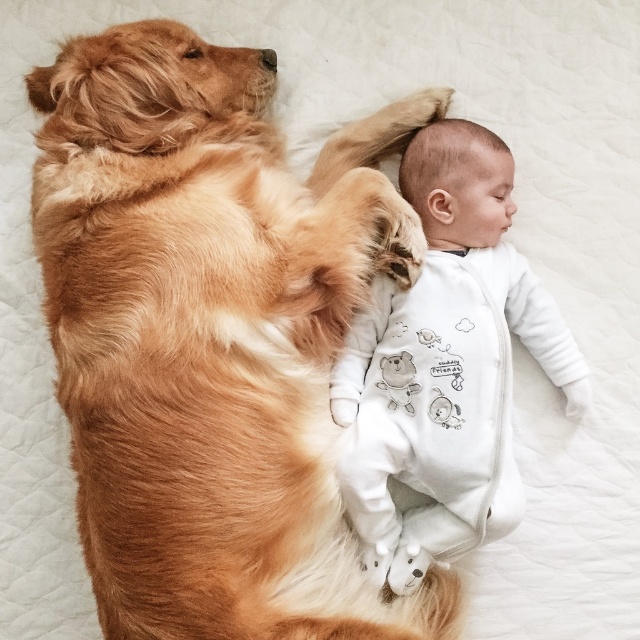
You are a parent holding a small toy that is 15 centimeters long. You want to place the toy between the golden fur dog at upper left and the white soft onesie at center so that both the dog and the baby can reach it easily. Is this possible?

The golden fur dog at upper left and the white soft onesie at center are 13.63 centimeters apart. Since the toy is 15 centimeters long, it cannot fit between them as the distance is shorter than the toy.

You are a photographer taking a picture of the golden fur dog at upper left. Where should you position your camera to capture the dog in the frame?

The golden fur dog at upper left is located at point (211, 336), so you should position your camera at that coordinate to capture the dog in the frame.

You are a parent who wants to ensure the baby in the white soft onesie at center is safe from the golden fur dog at upper left. Based on the scene, can the baby fit underneath the dog for protection?

The golden fur dog at upper left is taller than the white soft onesie at center, so the baby could potentially fit underneath the dog for protection since the dog is taller.